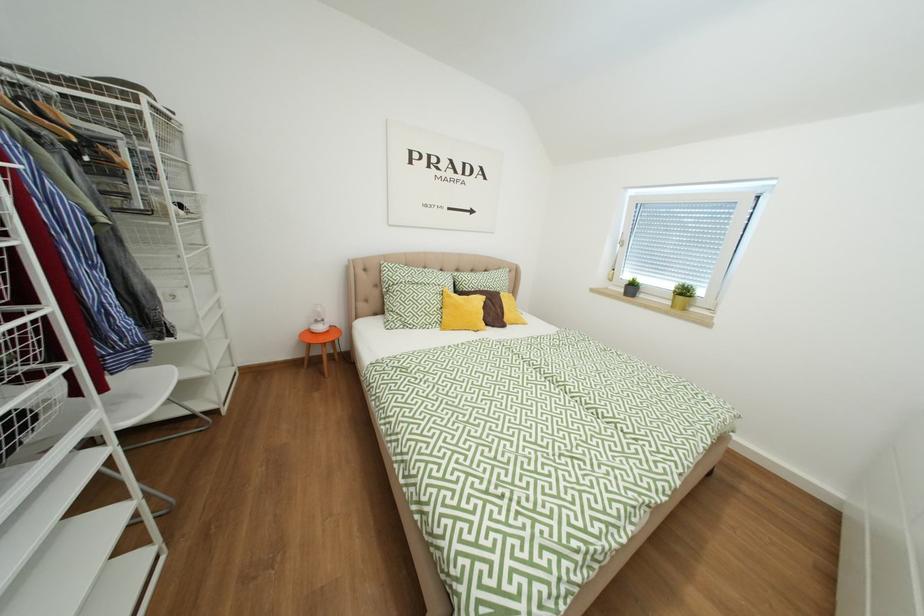
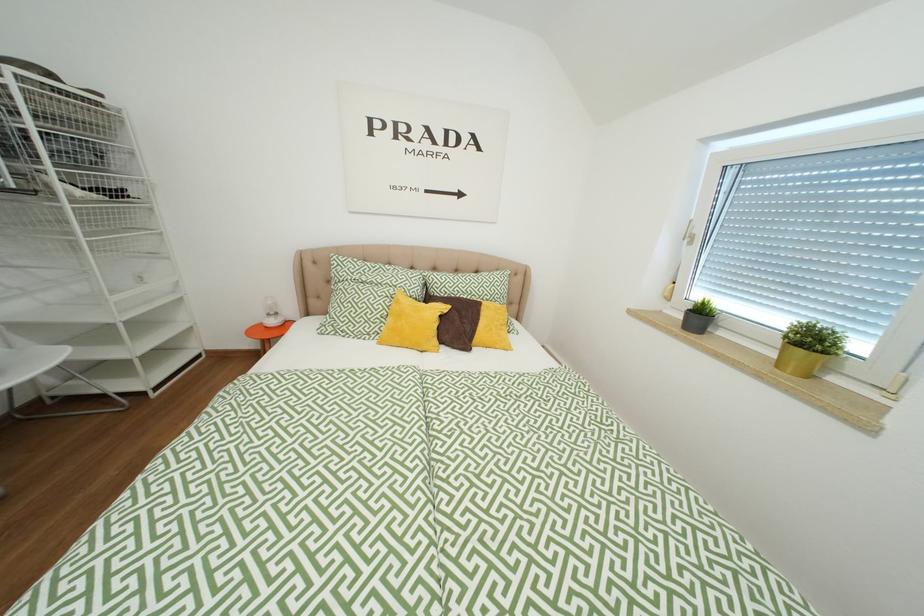
Which direction would the cameraman need to move to produce the second image?

The movement direction of the cameraman is right, forward.